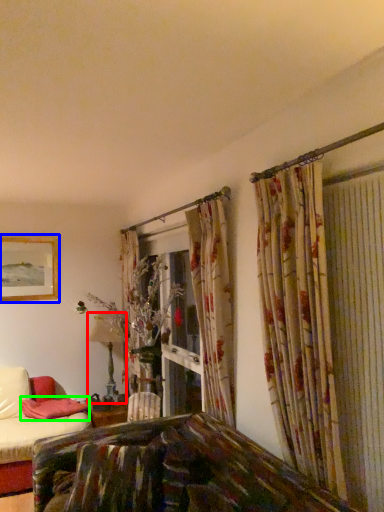
Question: Which object is the farthest from table lamp (highlighted by a red box)? Choose among these: picture frame (highlighted by a blue box) or pillow (highlighted by a green box).

Choices:
 (A) picture frame
 (B) pillow

Answer: (A)